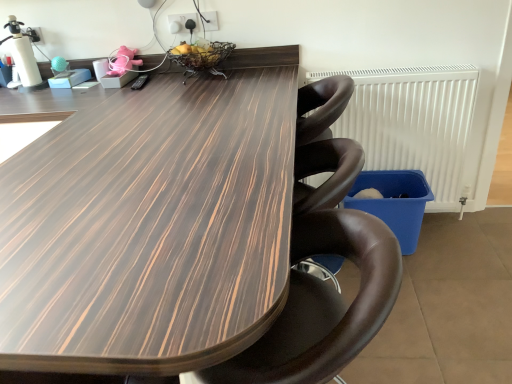
What do you see at coordinates (151, 226) in the screenshot? I see `wooden table at center` at bounding box center [151, 226].

Measure the distance between brown leather chair at center and camera.

A distance of 28.00 inches exists between brown leather chair at center and camera.

What are the coordinates of `pink fabric toy at upper center` in the screenshot? It's located at (123, 61).

From the picture: In terms of width, does brown leather chair at center look wider or thinner when compared to wooden table at center?

brown leather chair at center is thinner than wooden table at center.

Considering the sizes of objects brown leather chair at center and wooden table at center in the image provided, who is taller, brown leather chair at center or wooden table at center?

With more height is wooden table at center.

Is brown leather chair at center further to camera compared to wooden table at center?

Yes, the depth of brown leather chair at center is greater than that of wooden table at center.

From the image's perspective, between brown leather chair at center and white plastic radiator at right, which one is located above?

white plastic radiator at right is shown above in the image.

Is brown leather chair at center turned away from white plastic radiator at right?

brown leather chair at center is not turned away from white plastic radiator at right.

Is brown leather chair at center taller than white plastic radiator at right?

No, brown leather chair at center is not taller than white plastic radiator at right.

Looking at this image, can you confirm if white plastic radiator at right is taller than wooden table at center?

Incorrect, the height of white plastic radiator at right is not larger of that of wooden table at center.

Is white plastic radiator at right thinner than wooden table at center?

Yes.

Is white plastic radiator at right far from wooden table at center?

Yes, white plastic radiator at right is far from wooden table at center.

This screenshot has width=512, height=384. I want to click on radiator behind the wooden table at center, so click(x=413, y=122).

From the image's perspective, does wooden table at center appear higher than white plastic radiator at right?

No, from the image's perspective, wooden table at center is not over white plastic radiator at right.

Does wooden table at center have a lesser width compared to white plastic radiator at right?

In fact, wooden table at center might be wider than white plastic radiator at right.

Is wooden table at center looking in the opposite direction of white plastic radiator at right?

No.

Can you confirm if white plastic radiator at right is wider than brown leather chair at center?

Incorrect, the width of white plastic radiator at right does not surpass that of brown leather chair at center.

From the image's perspective, would you say white plastic radiator at right is shown under brown leather chair at center?

Incorrect, from the image's perspective, white plastic radiator at right is higher than brown leather chair at center.

Is white plastic radiator at right next to brown leather chair at center and touching it?

No, white plastic radiator at right is not beside brown leather chair at center.

From a real-world perspective, is white plastic radiator at right on top of brown leather chair at center?

Yes.

Considering the positions of objects white plastic radiator at right and pink fabric toy at upper center in the image provided, who is in front, white plastic radiator at right or pink fabric toy at upper center?

white plastic radiator at right.

Between white plastic radiator at right and pink fabric toy at upper center, which one has larger size?

white plastic radiator at right is bigger.

Considering the relative positions of white plastic radiator at right and pink fabric toy at upper center in the image provided, is white plastic radiator at right to the right of pink fabric toy at upper center from the viewer's perspective?

Yes.

Would you say white plastic radiator at right is a long distance from pink fabric toy at upper center?

Indeed, white plastic radiator at right is not near pink fabric toy at upper center.

From a real-world perspective, is pink fabric toy at upper center physically below brown leather chair at center?

No, from a real-world perspective, pink fabric toy at upper center is not beneath brown leather chair at center.

Consider the image. Is pink fabric toy at upper center wider or thinner than brown leather chair at center?

Clearly, pink fabric toy at upper center has less width compared to brown leather chair at center.

Identify the location of chair on the right of the pink fabric toy at upper center. Image resolution: width=512 pixels, height=384 pixels. click(323, 305).

Could you tell me if pink fabric toy at upper center is facing brown leather chair at center?

No.

This screenshot has height=384, width=512. Identify the location of table lying in front of the brown leather chair at center. (151, 226).

Image resolution: width=512 pixels, height=384 pixels. What are the coordinates of `radiator that is behind the brown leather chair at center` in the screenshot? It's located at (413, 122).

Which object lies further to the anchor point brown leather chair at center, white plastic radiator at right or pink fabric toy at upper center?

pink fabric toy at upper center lies further to brown leather chair at center than the other object.

From the image, which object appears to be nearer to pink fabric toy at upper center, white plastic radiator at right or wooden table at center?

wooden table at center is positioned closer to the anchor pink fabric toy at upper center.

Which object lies further to the anchor point wooden table at center, pink fabric toy at upper center or brown leather chair at center?

The object further to wooden table at center is pink fabric toy at upper center.

Based on their spatial positions, is brown leather chair at center or pink fabric toy at upper center further from wooden table at center?

pink fabric toy at upper center is further to wooden table at center.

When comparing their distances from white plastic radiator at right, does wooden table at center or pink fabric toy at upper center seem further?

pink fabric toy at upper center is further to white plastic radiator at right.

Consider the image. When comparing their distances from pink fabric toy at upper center, does brown leather chair at center or white plastic radiator at right seem further?

The object further to pink fabric toy at upper center is brown leather chair at center.

Which object lies further to the anchor point white plastic radiator at right, brown leather chair at center or pink fabric toy at upper center?

pink fabric toy at upper center.

Considering their positions, is pink fabric toy at upper center positioned further to white plastic radiator at right than brown leather chair at center?

Among the two, pink fabric toy at upper center is located further to white plastic radiator at right.

Find the location of a particular element. chair located between wooden table at center and white plastic radiator at right in the depth direction is located at coordinates (323, 305).

At what (x,y) coordinates should I click in order to perform the action: click on radiator located between wooden table at center and pink fabric toy at upper center in the depth direction. Please return your answer as a coordinate pair (x, y). Looking at the image, I should click on (413, 122).

This screenshot has height=384, width=512. What are the coordinates of `radiator between brown leather chair at center and pink fabric toy at upper center in the front-back direction` in the screenshot? It's located at (413, 122).

Find the location of a particular element. The width and height of the screenshot is (512, 384). chair between wooden table at center and pink fabric toy at upper center from front to back is located at coordinates (323, 305).